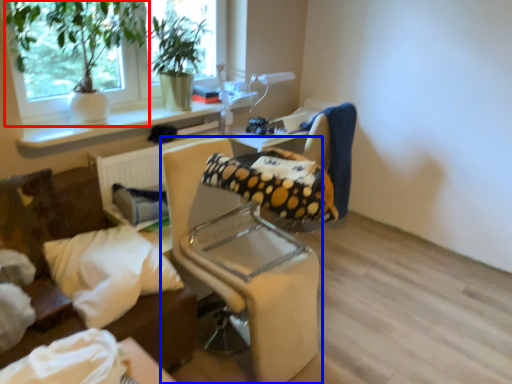
Question: Which point is further to the camera, houseplant (highlighted by a red box) or chair (highlighted by a blue box)?

Choices:
 (A) houseplant
 (B) chair

Answer: (A)